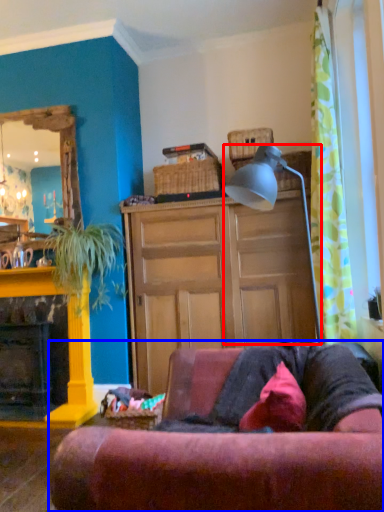
Question: Which of the following is the farthest to the observer, lamp (highlighted by a red box) or studio couch (highlighted by a blue box)?

Choices:
 (A) lamp
 (B) studio couch

Answer: (A)